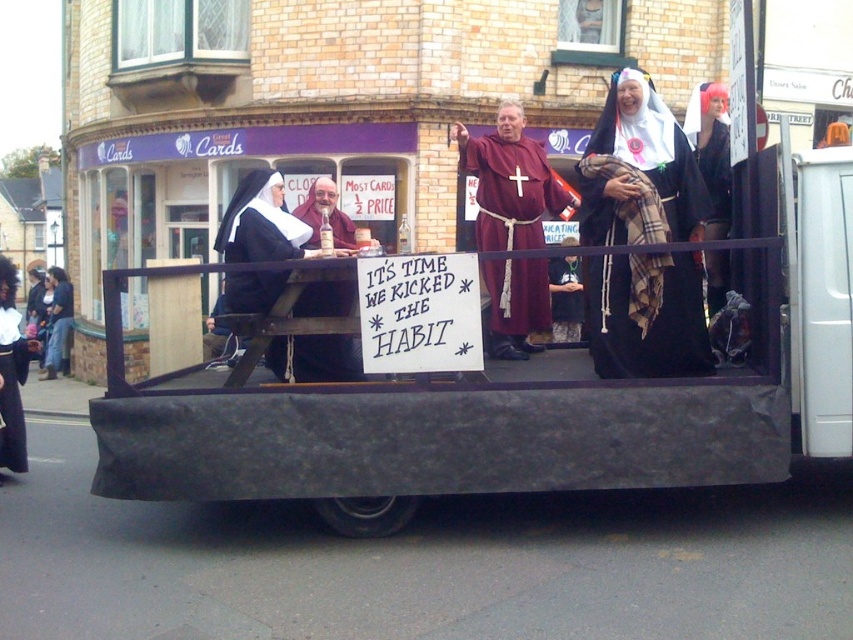
Is plaid woolen shawl at upper right positioned before maroon fabric cross at center?

Yes.

Who is more distant from viewer, (695, 308) or (488, 234)?

The point (488, 234) is behind.

What do you see at coordinates (639, 172) in the screenshot?
I see `plaid woolen shawl at upper right` at bounding box center [639, 172].

At what (x,y) coordinates should I click in order to perform the action: click on plaid woolen shawl at upper right. Please return your answer as a coordinate pair (x, y). The image size is (853, 640). Looking at the image, I should click on (639, 172).

From the picture: Is maroon fabric cross at center bigger than matte brown wooden table at center?

Yes.

Which of these two, maroon fabric cross at center or matte brown wooden table at center, stands taller?

maroon fabric cross at center is taller.

This screenshot has width=853, height=640. Find the location of `maroon fabric cross at center`. maroon fabric cross at center is located at coordinates (509, 182).

At what (x,y) coordinates should I click in order to perform the action: click on maroon fabric cross at center. Please return your answer as a coordinate pair (x, y). The width and height of the screenshot is (853, 640). Looking at the image, I should click on point(509,182).

Which is above, plaid woolen shawl at upper right or black velvet robe at left?

plaid woolen shawl at upper right is above.

Between point (660, 163) and point (47, 376), which one is positioned in front?

Point (660, 163) is in front.

Is point (694, 355) less distant than point (61, 316)?

Yes.

Where is `plaid woolen shawl at upper right`? plaid woolen shawl at upper right is located at coordinates (639, 172).